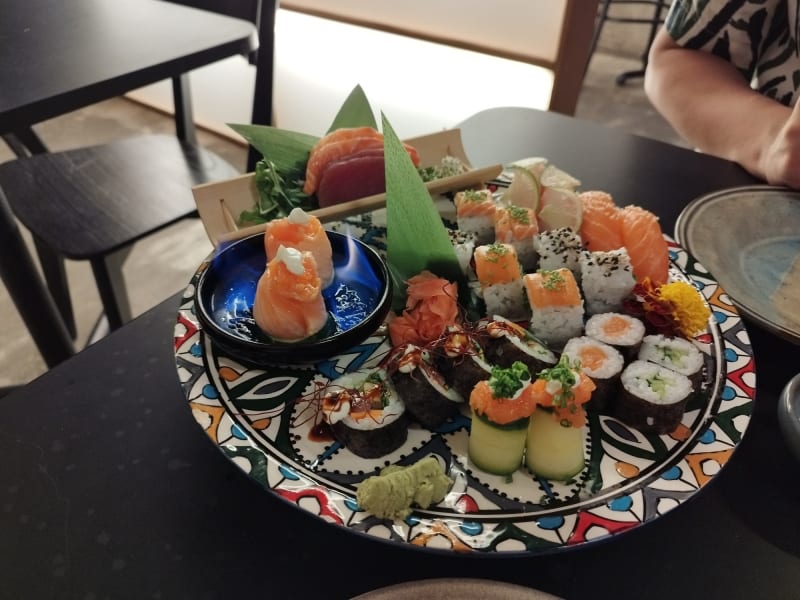
Where is `blue dish`? The width and height of the screenshot is (800, 600). blue dish is located at coordinates (229, 287).